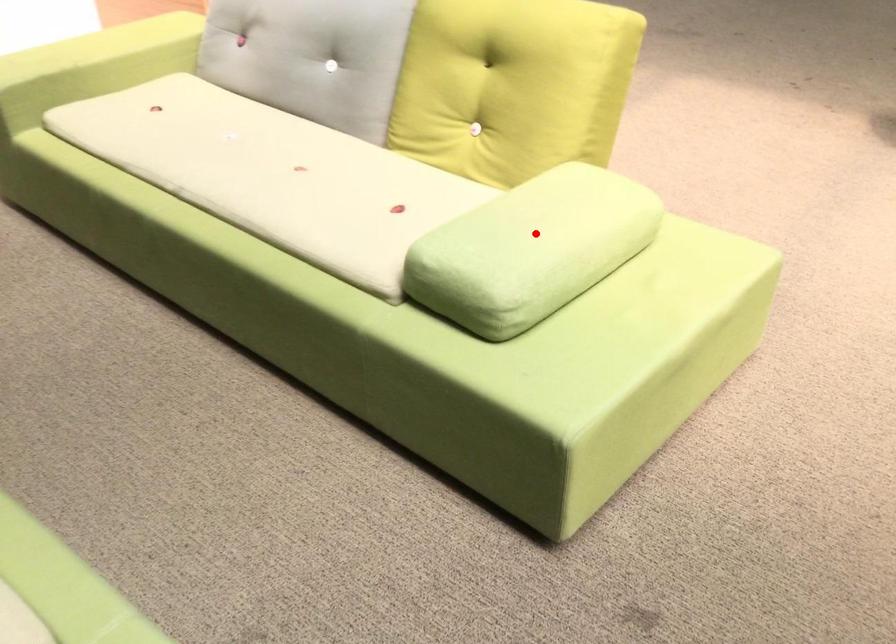
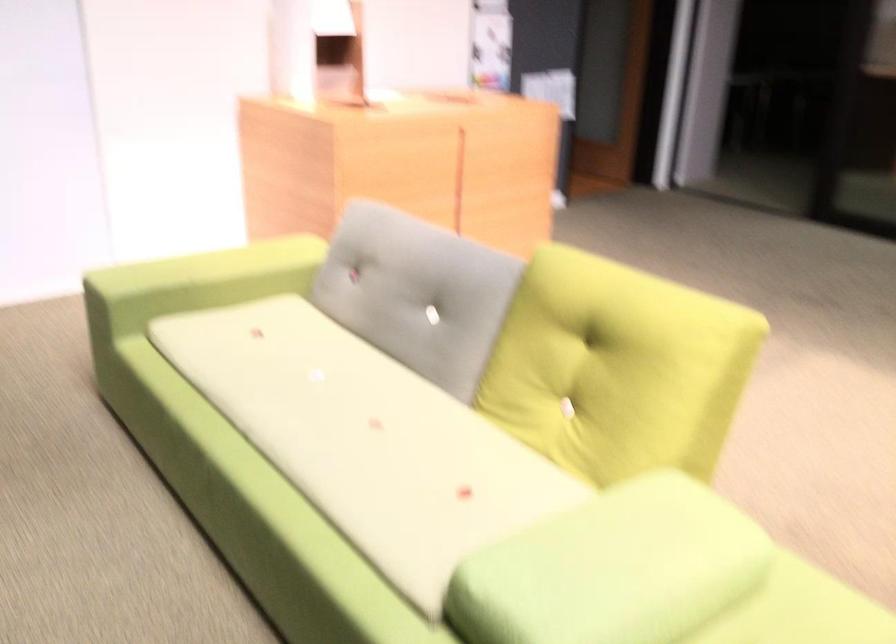
Question: I am providing you with two images of the same scene from different viewpoints. A red point is shown in image1. For the corresponding object point in image2, is it positioned nearer or farther from the camera?

Choices:
 (A) Nearer
 (B) Farther

Answer: (A)